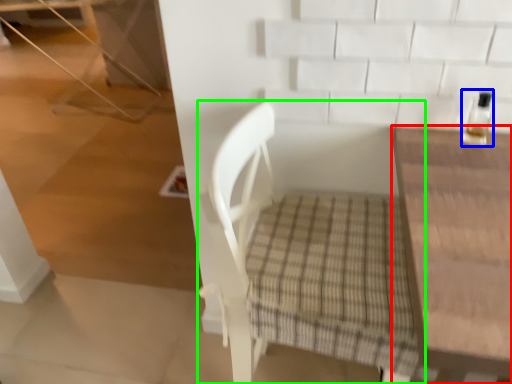
Question: Estimate the real-world distances between objects in this image. Which object is farther from table (highlighted by a red box), bottle (highlighted by a blue box) or chair (highlighted by a green box)?

Choices:
 (A) bottle
 (B) chair

Answer: (B)